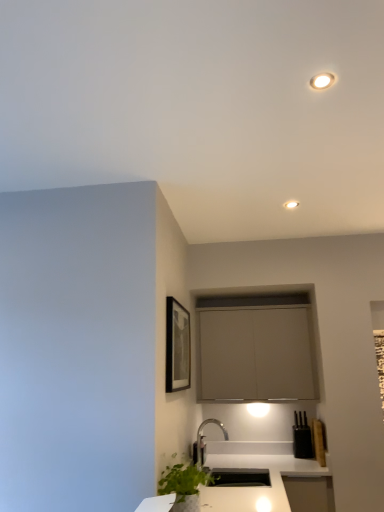
In order to face matte white recessed light at upper center, should I rotate leftwards or rightwards?

A 13.332 degree turn to the right will do.

This screenshot has width=384, height=512. What do you see at coordinates (184, 485) in the screenshot? I see `green leafy plant at lower left` at bounding box center [184, 485].

Locate an element on the screen. black matte picture frame at upper center is located at coordinates (177, 346).

Describe the element at coordinates (302, 437) in the screenshot. I see `black matte knife block at lower right` at that location.

Locate an element on the screen. The width and height of the screenshot is (384, 512). black matte knife block at lower right is located at coordinates (302, 437).

The image size is (384, 512). I want to click on matte white recessed light at upper center, so click(291, 204).

Between green leafy plant at lower left and black matte knife block at lower right, which one has larger width?

Wider between the two is green leafy plant at lower left.

From a real-world perspective, which is physically above, green leafy plant at lower left or black matte knife block at lower right?

black matte knife block at lower right is physically above.

In the scene shown: Is there a large distance between green leafy plant at lower left and black matte knife block at lower right?

Yes, green leafy plant at lower left is far from black matte knife block at lower right.

From the image's perspective, is green leafy plant at lower left below black matte knife block at lower right?

Actually, green leafy plant at lower left appears above black matte knife block at lower right in the image.

Is the surface of matte white recessed light at upper center in direct contact with black matte knife block at lower right?

matte white recessed light at upper center is not next to black matte knife block at lower right, and they're not touching.

Based on the photo, is matte white recessed light at upper center facing away from black matte knife block at lower right?

No, matte white recessed light at upper center's orientation is not away from black matte knife block at lower right.

Find the location of a particular element. light fixture in front of the black matte knife block at lower right is located at coordinates (291, 204).

Is black matte knife block at lower right located within matte white recessed light at upper center?

No, black matte knife block at lower right is not inside matte white recessed light at upper center.

Considering the relative sizes of black matte picture frame at upper center and black matte knife block at lower right in the image provided, is black matte picture frame at upper center bigger than black matte knife block at lower right?

Yes, black matte picture frame at upper center is bigger than black matte knife block at lower right.

Does black matte picture frame at upper center appear on the left side of black matte knife block at lower right?

Yes, black matte picture frame at upper center is to the left of black matte knife block at lower right.

How different are the orientations of black matte picture frame at upper center and black matte knife block at lower right in degrees?

89.6 degrees.

Considering their positions, is black matte picture frame at upper center located in front of or behind black matte knife block at lower right?

Visually, black matte picture frame at upper center is located in front of black matte knife block at lower right.

Is black matte knife block at lower right in front of or behind green leafy plant at lower left in the image?

In the image, black matte knife block at lower right appears behind green leafy plant at lower left.

From a real-world perspective, is black matte knife block at lower right positioned above or below green leafy plant at lower left?

In terms of real-world spatial position, black matte knife block at lower right is above green leafy plant at lower left.

Is black matte knife block at lower right positioned far away from green leafy plant at lower left?

Absolutely, black matte knife block at lower right is distant from green leafy plant at lower left.

From the image's perspective, which object appears higher, black matte knife block at lower right or black matte picture frame at upper center?

black matte picture frame at upper center, from the image's perspective.

Is black matte knife block at lower right bigger than black matte picture frame at upper center?

No.

This screenshot has height=512, width=384. What are the coordinates of `appliance located on the right of black matte picture frame at upper center` in the screenshot? It's located at (302, 437).

Does black matte knife block at lower right have a lesser height compared to black matte picture frame at upper center?

Yes.

Does matte white recessed light at upper center turn towards white glossy countertop at lower center?

No, matte white recessed light at upper center does not turn towards white glossy countertop at lower center.

In the image, is matte white recessed light at upper center on the left side or the right side of white glossy countertop at lower center?

From the image, it's evident that matte white recessed light at upper center is to the right of white glossy countertop at lower center.

Is matte white recessed light at upper center positioned far away from white glossy countertop at lower center?

Yes, matte white recessed light at upper center is far from white glossy countertop at lower center.

Locate an element on the screen. The image size is (384, 512). countertop lying below the matte white recessed light at upper center (from the image's perspective) is located at coordinates (258, 472).

How different are the orientations of matte gray cabinet at center and matte white recessed light at upper center in degrees?

matte gray cabinet at center and matte white recessed light at upper center are facing 1.19 degrees away from each other.

Identify the location of light fixture above the matte gray cabinet at center (from a real-world perspective). (291, 204).

From a real-world perspective, is matte gray cabinet at center above or below matte white recessed light at upper center?

From a real-world perspective, matte gray cabinet at center is physically below matte white recessed light at upper center.

Is point (289, 353) less distant than point (291, 204)?

That is False.

This screenshot has width=384, height=512. What are the coordinates of `appliance below the green leafy plant at lower left (from the image's perspective)` in the screenshot? It's located at (302, 437).

You are a GUI agent. You are given a task and a screenshot of the screen. Output one action in this format:
    pyautogui.click(x=<x>, y=<y>)
    Task: Click on the appliance on the right of matte white recessed light at upper center
    This screenshot has width=384, height=512.
    Given the screenshot: What is the action you would take?
    pyautogui.click(x=302, y=437)

From the image, which object appears to be farther from matte gray cabinet at center, black matte knife block at lower right or matte white recessed light at upper center?

Among the two, matte white recessed light at upper center is located further to matte gray cabinet at center.

Which object lies further to the anchor point matte white recessed light at upper center, black matte picture frame at upper center or matte gray cabinet at center?

matte gray cabinet at center is positioned further to the anchor matte white recessed light at upper center.

Which object lies further to the anchor point black matte knife block at lower right, black matte picture frame at upper center or green leafy plant at lower left?

The object further to black matte knife block at lower right is green leafy plant at lower left.

Looking at this image, estimate the real-world distances between objects in this image. Which object is closer to black matte knife block at lower right, matte white recessed light at upper center or white glossy countertop at lower center?

white glossy countertop at lower center is closer to black matte knife block at lower right.

Based on their spatial positions, is black matte knife block at lower right or green leafy plant at lower left further from black matte picture frame at upper center?

Based on the image, black matte knife block at lower right appears to be further to black matte picture frame at upper center.

Which object lies further to the anchor point matte gray cabinet at center, black matte picture frame at upper center or black matte knife block at lower right?

The object further to matte gray cabinet at center is black matte knife block at lower right.

Considering their positions, is matte white recessed light at upper center positioned further to black matte picture frame at upper center than white glossy countertop at lower center?

Among the two, matte white recessed light at upper center is located further to black matte picture frame at upper center.

From the image, which object appears to be farther from black matte picture frame at upper center, matte white recessed light at upper center or black matte knife block at lower right?

Based on the image, matte white recessed light at upper center appears to be further to black matte picture frame at upper center.

What are the coordinates of `picture frame positioned between white glossy countertop at lower center and black matte knife block at lower right from near to far` in the screenshot? It's located at (177, 346).

At what (x,y) coordinates should I click in order to perform the action: click on houseplant between matte white recessed light at upper center and black matte knife block at lower right vertically. Please return your answer as a coordinate pair (x, y). This screenshot has width=384, height=512. Looking at the image, I should click on (184, 485).

Locate an element on the screen. The width and height of the screenshot is (384, 512). houseplant between matte white recessed light at upper center and white glossy countertop at lower center vertically is located at coordinates (184, 485).

Where is `cabinetry between matte white recessed light at upper center and white glossy countertop at lower center in the vertical direction`? cabinetry between matte white recessed light at upper center and white glossy countertop at lower center in the vertical direction is located at coordinates (x=255, y=348).